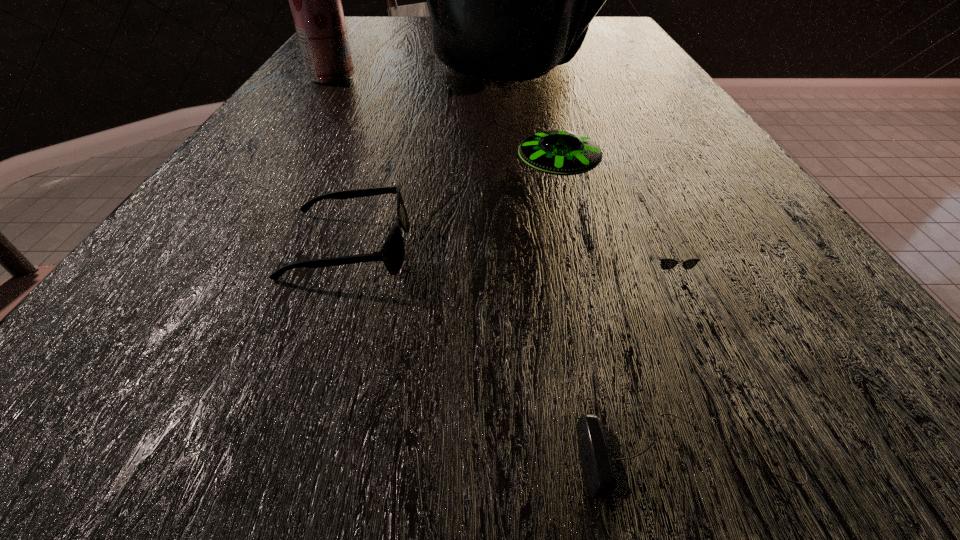
Find the location of a particular element. plastic bag is located at coordinates (509, 0).

This screenshot has height=540, width=960. Identify the location of fruit juice. (315, 0).

Locate an element on the screen. the second tallest object is located at coordinates (315, 0).

Image resolution: width=960 pixels, height=540 pixels. I want to click on the fourth shortest object, so click(562, 152).

Find the location of a particular element. The height and width of the screenshot is (540, 960). saucer is located at coordinates (562, 152).

This screenshot has height=540, width=960. I want to click on the left sunglasses, so click(392, 254).

This screenshot has width=960, height=540. Identify the location of the right sunglasses. (666, 263).

At what (x,y) coordinates should I click in order to perform the action: click on the nearest object. Please return your answer as a coordinate pair (x, y). The height and width of the screenshot is (540, 960). Looking at the image, I should click on (600, 454).

Locate an element on the screen. This screenshot has width=960, height=540. webcam is located at coordinates (600, 454).

What are the coordinates of `free space located 0.050m on the back of the plastic bag` in the screenshot? It's located at (509, 33).